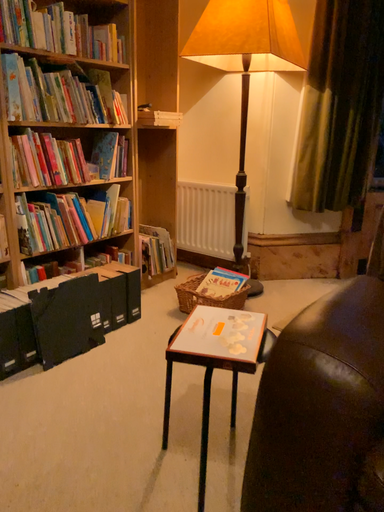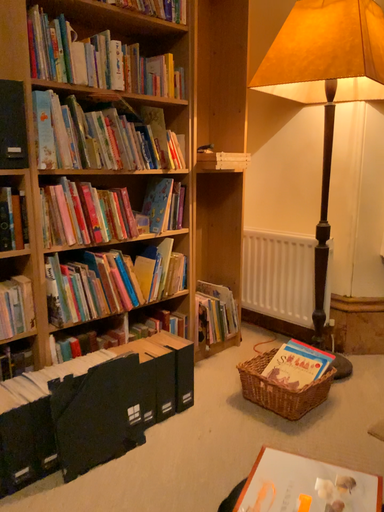
Question: How did the camera likely rotate when shooting the video?

Choices:
 (A) rotated right
 (B) rotated left

Answer: (B)